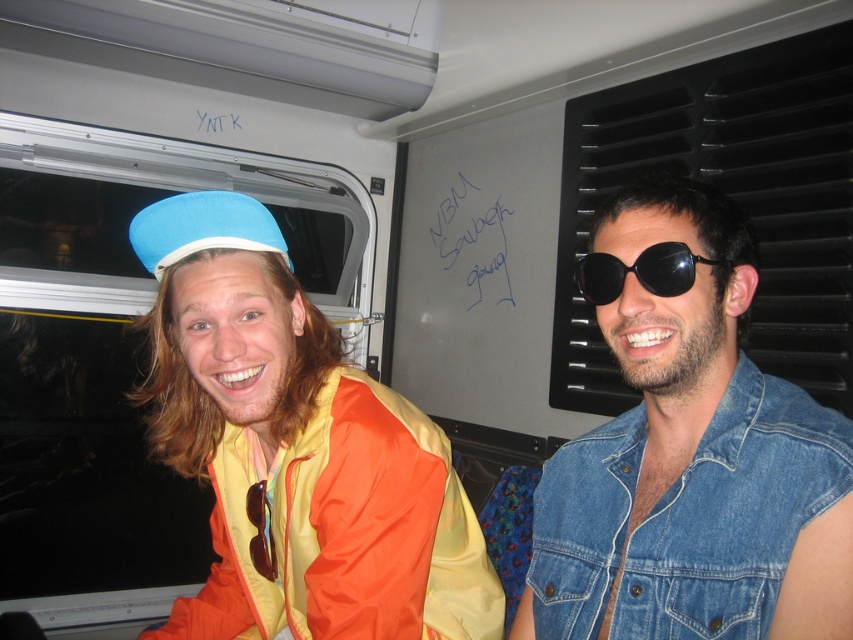
Which is more to the left, faded denim jacket at lower right or matte blue fabric hat at left?

Positioned to the left is matte blue fabric hat at left.

Is point (608, 636) farther from viewer compared to point (244, 218)?

No.

Between point (753, 538) and point (225, 202), which one is positioned in front?

Point (753, 538) is more forward.

Identify the location of faded denim jacket at lower right. The image size is (853, 640). (685, 518).

Does faded denim jacket at lower right have a greater width compared to black reflective sunglasses at right?

Correct, the width of faded denim jacket at lower right exceeds that of black reflective sunglasses at right.

Does faded denim jacket at lower right appear on the left side of black reflective sunglasses at right?

No, faded denim jacket at lower right is not to the left of black reflective sunglasses at right.

This screenshot has height=640, width=853. I want to click on faded denim jacket at lower right, so click(x=685, y=518).

Locate an element on the screen. The image size is (853, 640). faded denim jacket at lower right is located at coordinates (685, 518).

Is point (241, 212) positioned behind point (663, 243)?

Yes.

What do you see at coordinates (202, 227) in the screenshot?
I see `matte blue fabric hat at left` at bounding box center [202, 227].

Does point (230, 214) come behind point (666, 252)?

Yes, it is.

Find the location of a particular element. The image size is (853, 640). matte blue fabric hat at left is located at coordinates (202, 227).